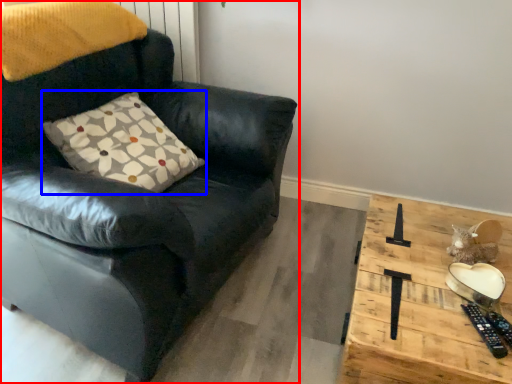
Question: Which object appears farthest to the camera in this image, chair (highlighted by a red box) or pillow (highlighted by a blue box)?

Choices:
 (A) chair
 (B) pillow

Answer: (B)